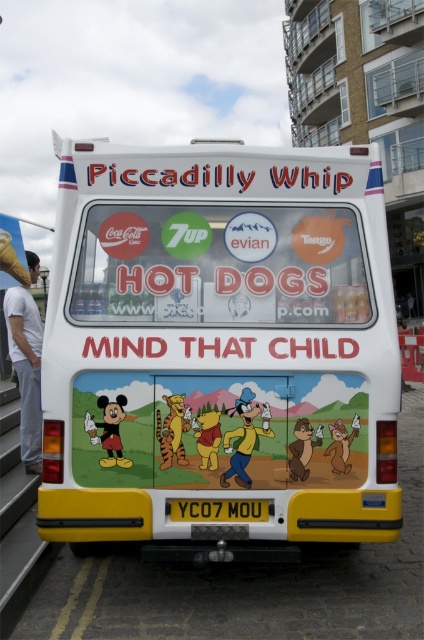
Question: Does white plastic food truck at center lie behind yellow/yellowish plastic at center?

Choices:
 (A) no
 (B) yes

Answer: (A)

Question: Which point is farther to the camera?

Choices:
 (A) (219, 520)
 (B) (312, 497)

Answer: (A)

Question: Which object appears farthest from the camera in this image?

Choices:
 (A) white plastic food truck at center
 (B) yellow/yellowish plastic at center

Answer: (B)

Question: Can you confirm if white plastic food truck at center is positioned below yellow/yellowish plastic at center?

Choices:
 (A) no
 (B) yes

Answer: (A)

Question: Can you confirm if white plastic food truck at center is thinner than yellow/yellowish plastic at center?

Choices:
 (A) yes
 (B) no

Answer: (B)